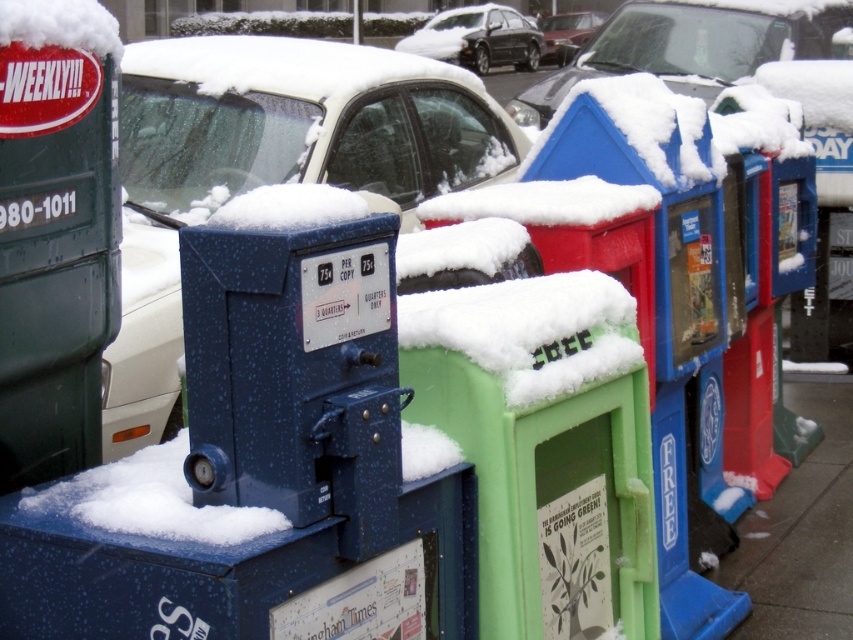
You are standing at the edge of the gray concrete sidewalk at lower right and want to walk towards the metallic silver sedan at center. Is the path clear, or do you need to step over or around any objects?

The gray concrete sidewalk at lower right is closer to the viewer than the metallic silver sedan at center, so you would need to step over or around the metallic silver sedan at center to reach it.